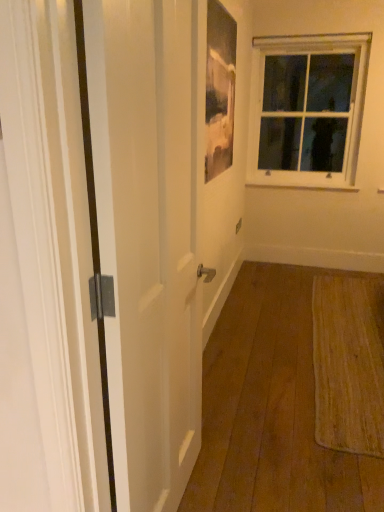
What do you see at coordinates (219, 89) in the screenshot? I see `matte glass picture frame at upper center` at bounding box center [219, 89].

At what (x,y) coordinates should I click in order to perform the action: click on clear glass window at upper right. Please return your answer as a coordinate pair (x, y). The width and height of the screenshot is (384, 512). Looking at the image, I should click on (307, 108).

In order to face white painted wood at upper right, should I rotate leftwards or rightwards?

It's best to rotate right around 14.463 degrees.

This screenshot has height=512, width=384. In order to click on matte glass picture frame at upper center in this screenshot , I will do `click(219, 89)`.

Does point (347, 186) appear closer or farther from the camera than point (284, 170)?

Point (347, 186) is positioned closer to the camera compared to point (284, 170).

Is white painted wood at upper right wider or thinner than clear glass window at upper right?

Considering their sizes, white painted wood at upper right looks slimmer than clear glass window at upper right.

In terms of size, does white painted wood at upper right appear bigger or smaller than clear glass window at upper right?

white painted wood at upper right is smaller than clear glass window at upper right.

Is white painted wood at upper right placed right next to clear glass window at upper right?

white painted wood at upper right and clear glass window at upper right are not in contact.

Between matte glass picture frame at upper center and white glossy door at left, which one appears on the left side from the viewer's perspective?

Positioned to the left is white glossy door at left.

Is matte glass picture frame at upper center not near white glossy door at left?

Indeed, matte glass picture frame at upper center is not near white glossy door at left.

From a real-world perspective, relative to white glossy door at left, is matte glass picture frame at upper center vertically above or below?

Clearly, from a real-world perspective, matte glass picture frame at upper center is above white glossy door at left.

Which of these two, white glossy door at left or white painted wood at upper right, is wider?

Wider between the two is white glossy door at left.

The height and width of the screenshot is (512, 384). Identify the location of screen door below the white painted wood at upper right (from the image's perspective). 153,241.

Is white glossy door at left oriented towards white painted wood at upper right?

No, white glossy door at left is not facing towards white painted wood at upper right.

How far apart are white glossy door at left and white painted wood at upper right?

white glossy door at left is 2.96 meters from white painted wood at upper right.

Does white glossy door at left lie in front of clear glass window at upper right?

Yes, the depth of white glossy door at left is less than that of clear glass window at upper right.

Can you tell me how much white glossy door at left and clear glass window at upper right differ in facing direction?

89.4 degrees.

Can you see white glossy door at left touching clear glass window at upper right?

No, white glossy door at left is not making contact with clear glass window at upper right.

From a real-world perspective, is white glossy door at left physically located above or below clear glass window at upper right?

Clearly, from a real-world perspective, white glossy door at left is below clear glass window at upper right.

How different are the orientations of white painted wood at upper right and matte glass picture frame at upper center in degrees?

91.4 degrees.

Where is `picture frame lying in front of the white painted wood at upper right`? The width and height of the screenshot is (384, 512). picture frame lying in front of the white painted wood at upper right is located at coordinates (219, 89).

Is white painted wood at upper right turned away from matte glass picture frame at upper center?

No, white painted wood at upper right's orientation is not away from matte glass picture frame at upper center.

Which is in front, clear glass window at upper right or white painted wood at upper right?

clear glass window at upper right.

Measure the distance from clear glass window at upper right to white painted wood at upper right.

clear glass window at upper right is 62.09 centimeters away from white painted wood at upper right.

From the picture: Is white painted wood at upper right at the back of clear glass window at upper right?

No, clear glass window at upper right is not facing away from white painted wood at upper right.

From the image's perspective, which one is positioned lower, clear glass window at upper right or white painted wood at upper right?

white painted wood at upper right appears lower in the image.

Is clear glass window at upper right further to the viewer compared to white glossy door at left?

Yes, the depth of clear glass window at upper right is greater than that of white glossy door at left.

Can you confirm if clear glass window at upper right is smaller than white glossy door at left?

Actually, clear glass window at upper right might be larger than white glossy door at left.

What's the angular difference between clear glass window at upper right and white glossy door at left's facing directions?

The angular difference between clear glass window at upper right and white glossy door at left is 89.4 degrees.

Is clear glass window at upper right wider than white glossy door at left?

Indeed, clear glass window at upper right has a greater width compared to white glossy door at left.

At what (x,y) coordinates should I click in order to perform the action: click on window to the left of white painted wood at upper right. Please return your answer as a coordinate pair (x, y). Looking at the image, I should click on (307, 108).

Image resolution: width=384 pixels, height=512 pixels. Find the location of `screen door below the matte glass picture frame at upper center (from a real-world perspective)`. screen door below the matte glass picture frame at upper center (from a real-world perspective) is located at coordinates (153, 241).

From the picture: From the image, which object appears to be farther from white glossy door at left, white painted wood at upper right or matte glass picture frame at upper center?

white painted wood at upper right lies further to white glossy door at left than the other object.

Which object lies nearer to the anchor point white painted wood at upper right, matte glass picture frame at upper center or white glossy door at left?

matte glass picture frame at upper center is positioned closer to the anchor white painted wood at upper right.

Considering their positions, is white glossy door at left positioned closer to white painted wood at upper right than matte glass picture frame at upper center?

Among the two, matte glass picture frame at upper center is located nearer to white painted wood at upper right.

Based on their spatial positions, is white painted wood at upper right or white glossy door at left further from matte glass picture frame at upper center?

Result: The object further to matte glass picture frame at upper center is white painted wood at upper right.

When comparing their distances from white glossy door at left, does clear glass window at upper right or matte glass picture frame at upper center seem closer?

Based on the image, matte glass picture frame at upper center appears to be nearer to white glossy door at left.

Which object lies further to the anchor point clear glass window at upper right, white glossy door at left or white painted wood at upper right?

The object further to clear glass window at upper right is white glossy door at left.

In the scene shown: From the image, which object appears to be farther from white painted wood at upper right, matte glass picture frame at upper center or clear glass window at upper right?

matte glass picture frame at upper center is positioned further to the anchor white painted wood at upper right.

Estimate the real-world distances between objects in this image. Which object is closer to white glossy door at left, matte glass picture frame at upper center or clear glass window at upper right?

The object closer to white glossy door at left is matte glass picture frame at upper center.

At what (x,y) coordinates should I click in order to perform the action: click on window between white glossy door at left and white painted wood at upper right along the z-axis. Please return your answer as a coordinate pair (x, y). This screenshot has height=512, width=384. Looking at the image, I should click on (307, 108).

Identify the location of picture frame positioned between white glossy door at left and white painted wood at upper right from near to far. The width and height of the screenshot is (384, 512). (219, 89).

You are a GUI agent. You are given a task and a screenshot of the screen. Output one action in this format:
    pyautogui.click(x=<x>, y=<y>)
    Task: Click on the picture frame positioned between white glossy door at left and clear glass window at upper right from near to far
    Image resolution: width=384 pixels, height=512 pixels.
    Given the screenshot: What is the action you would take?
    pyautogui.click(x=219, y=89)

In order to click on window between matte glass picture frame at upper center and white painted wood at upper right in the front-back direction in this screenshot , I will do `click(307, 108)`.